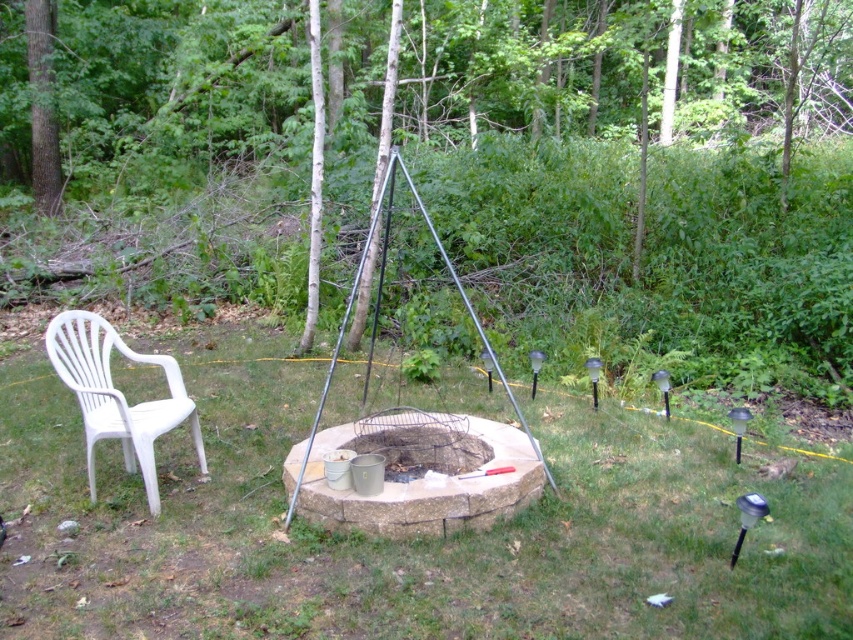
You are planning to set up a small table between the brown wood tree at center and the white plastic chair at left. Considering their sizes, which object might require more space around it to avoid blocking the table?

The brown wood tree at center is larger in size than the white plastic chair at left, so it would require more space around it to avoid blocking the table.

You are planning to set up a picnic blanket in the backyard. The brown wood tree at center and the white plastic chair at left are in the way. Which object must you move first to clear the central area?

The brown wood tree at center must be moved first because it is positioned over the white plastic chair at left, meaning it is closer to the center area and blocking access.